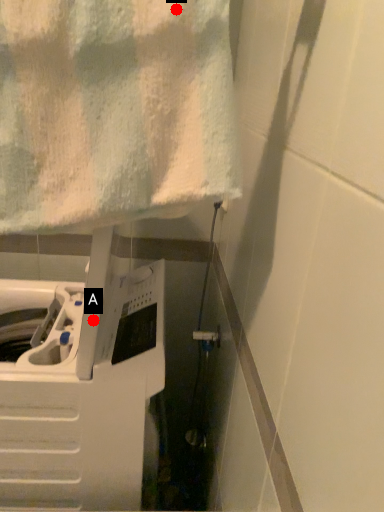
Question: Two points are circled on the image, labeled by A and B beside each circle. Which of the following is the farthest from the observer?

Choices:
 (A) A is further
 (B) B is further

Answer: (A)